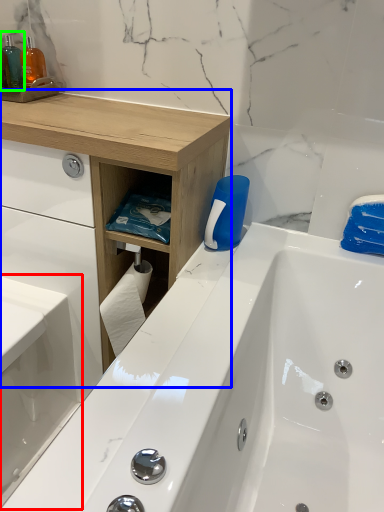
Question: Which object is positioned farthest from sink (highlighted by a red box)? Select from counter (highlighted by a blue box) and toiletry (highlighted by a green box).

Choices:
 (A) counter
 (B) toiletry

Answer: (B)